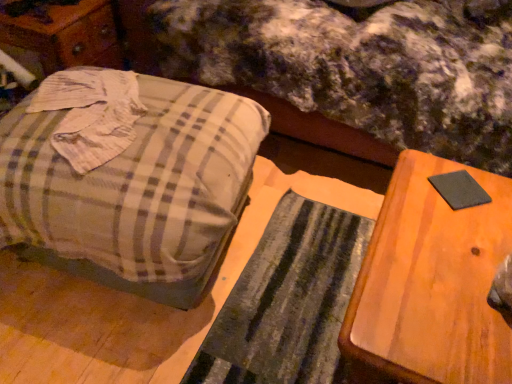
Locate an element on the screen. The width and height of the screenshot is (512, 384). free point to the left of black felt pad at right is located at coordinates 411,199.